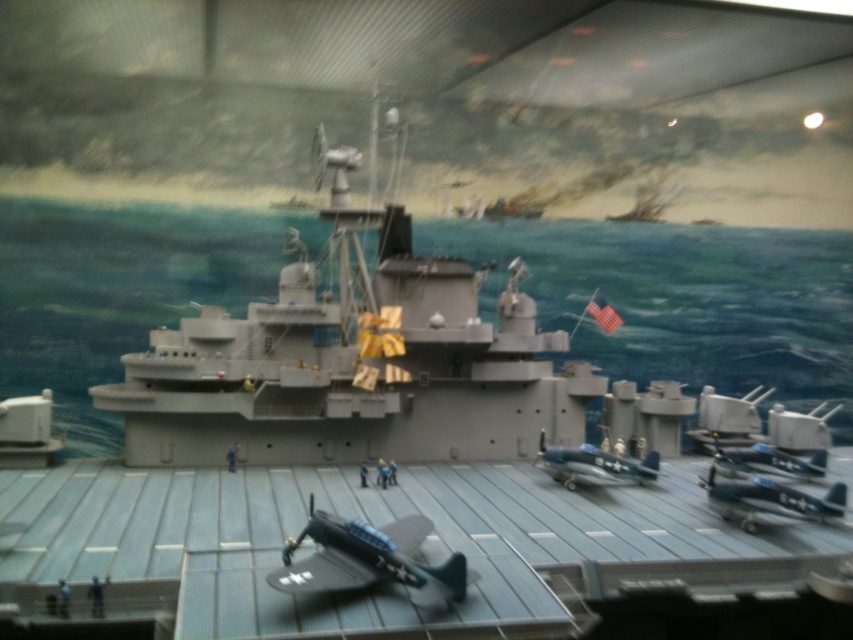
Question: In this image, where is blue metallic airplane at center located relative to metallic blue airplane at center-right?

Choices:
 (A) left
 (B) right

Answer: (A)

Question: Which object is closer to the camera taking this photo?

Choices:
 (A) matte black airplane at center
 (B) metallic blue airplane at center-right
 (C) blue metallic airplane at center
 (D) metallic blue airplane at center

Answer: (A)

Question: Is matte black airplane at center further to the viewer compared to metallic blue airplane at center?

Choices:
 (A) yes
 (B) no

Answer: (B)

Question: Which of the following is the closest to the observer?

Choices:
 (A) matte black airplane at center
 (B) blue metallic airplane at center
 (C) metallic blue airplane at center

Answer: (A)

Question: Does matte black airplane at center come in front of blue metallic airplane at center?

Choices:
 (A) no
 (B) yes

Answer: (B)

Question: Which point is closer to the camera?

Choices:
 (A) metallic blue airplane at center-right
 (B) blue metallic airplane at center
 (C) matte black airplane at center

Answer: (C)